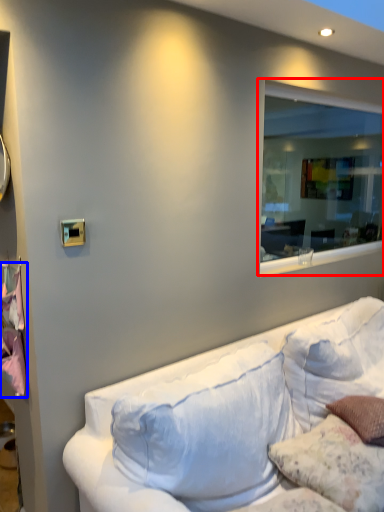
Question: Among these objects, which one is nearest to the camera, window (highlighted by a red box) or sheet (highlighted by a blue box)?

Choices:
 (A) window
 (B) sheet

Answer: (B)